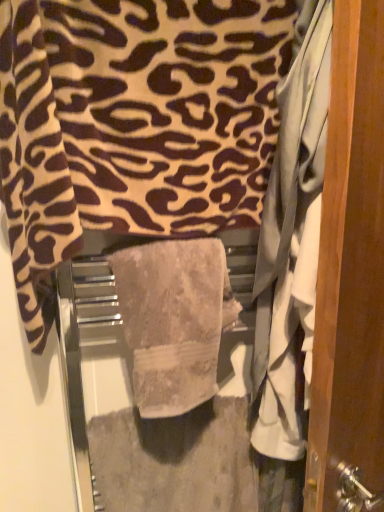
What do you see at coordinates (351, 276) in the screenshot?
I see `wooden door at right` at bounding box center [351, 276].

Find the location of a particular element. The image size is (384, 512). wooden door at right is located at coordinates (351, 276).

Is beige textured towel at center, which appears as the second towel when ordered from the bottom, in contact with beige textured towel at center, which is counted as the first towel, starting from the bottom?

beige textured towel at center, which appears as the second towel when ordered from the bottom, is not next to beige textured towel at center, which is counted as the first towel, starting from the bottom, and they're not touching.

Considering the sizes of objects beige textured towel at center, arranged as the 1th towel when viewed from the top, and beige textured towel at center, which is counted as the first towel, starting from the bottom, in the image provided, who is thinner, beige textured towel at center, arranged as the 1th towel when viewed from the top, or beige textured towel at center, which is counted as the first towel, starting from the bottom,?

beige textured towel at center, which is counted as the first towel, starting from the bottom.

Does beige textured towel at center, arranged as the 1th towel when viewed from the top, have a larger size compared to beige textured towel at center, acting as the 2th towel starting from the top?

Yes, beige textured towel at center, arranged as the 1th towel when viewed from the top, is bigger than beige textured towel at center, acting as the 2th towel starting from the top.

Can you confirm if beige textured towel at center, which appears as the second towel when ordered from the bottom, is shorter than beige textured towel at center, which is counted as the first towel, starting from the bottom?

Incorrect, the height of beige textured towel at center, which appears as the second towel when ordered from the bottom, does not fall short of that of beige textured towel at center, which is counted as the first towel, starting from the bottom.

From the image's perspective, who appears lower, wooden door at right or beige textured towel at center, arranged as the 1th towel when viewed from the top?

wooden door at right, from the image's perspective.

Is point (370, 269) behind point (261, 91)?

No, it is in front of (261, 91).

Between wooden door at right and beige textured towel at center, which appears as the second towel when ordered from the bottom, which one appears on the left side from the viewer's perspective?

Positioned to the left is beige textured towel at center, which appears as the second towel when ordered from the bottom.

In terms of height, does beige textured towel at center, which is counted as the first towel, starting from the bottom, look taller or shorter compared to wooden door at right?

beige textured towel at center, which is counted as the first towel, starting from the bottom, is shorter than wooden door at right.

Where is `towel that is under the wooden door at right (from a real-world perspective)`? towel that is under the wooden door at right (from a real-world perspective) is located at coordinates (174, 320).

From the image's perspective, is beige textured towel at center, which is counted as the first towel, starting from the bottom, above or below wooden door at right?

Clearly, from the image's perspective, beige textured towel at center, which is counted as the first towel, starting from the bottom, is below wooden door at right.

What's the angular difference between beige textured towel at center, which is counted as the first towel, starting from the bottom, and wooden door at right's facing directions?

They differ by 153 degrees in their facing directions.

From the picture: From a real-world perspective, is beige textured towel at center, which appears as the second towel when ordered from the bottom, located higher than wooden door at right?

Yes, from a real-world perspective, beige textured towel at center, which appears as the second towel when ordered from the bottom, is over wooden door at right

Image resolution: width=384 pixels, height=512 pixels. What are the coordinates of `towel that is the 1st one when counting backward from the wooden door at right` in the screenshot? It's located at pyautogui.click(x=132, y=124).

Between beige textured towel at center, arranged as the 1th towel when viewed from the top, and wooden door at right, which one has more height?

With more height is wooden door at right.

Considering the relative sizes of wooden door at right and beige textured towel at center, which is counted as the first towel, starting from the bottom, in the image provided, is wooden door at right wider than beige textured towel at center, which is counted as the first towel, starting from the bottom,?

No, wooden door at right is not wider than beige textured towel at center, which is counted as the first towel, starting from the bottom.

Considering the sizes of objects wooden door at right and beige textured towel at center, acting as the 2th towel starting from the top, in the image provided, who is taller, wooden door at right or beige textured towel at center, acting as the 2th towel starting from the top,?

wooden door at right is taller.

Are wooden door at right and beige textured towel at center, acting as the 2th towel starting from the top, making contact?

No, wooden door at right is not in contact with beige textured towel at center, acting as the 2th towel starting from the top.

Does wooden door at right turn towards beige textured towel at center, acting as the 2th towel starting from the top?

No, wooden door at right is not oriented towards beige textured towel at center, acting as the 2th towel starting from the top.

You are a GUI agent. You are given a task and a screenshot of the screen. Output one action in this format:
    pyautogui.click(x=<x>, y=<y>)
    Task: Click on the towel below the beige textured towel at center, which appears as the second towel when ordered from the bottom (from a real-world perspective)
    
    Given the screenshot: What is the action you would take?
    pyautogui.click(x=174, y=320)

Which is behind, beige textured towel at center, which is counted as the first towel, starting from the bottom, or beige textured towel at center, arranged as the 1th towel when viewed from the top?

beige textured towel at center, which is counted as the first towel, starting from the bottom, is further from the camera.

Measure the distance from beige textured towel at center, which is counted as the first towel, starting from the bottom, to beige textured towel at center, arranged as the 1th towel when viewed from the top.

The distance of beige textured towel at center, which is counted as the first towel, starting from the bottom, from beige textured towel at center, arranged as the 1th towel when viewed from the top, is 7.58 inches.

Locate an element on the screen. Image resolution: width=384 pixels, height=512 pixels. towel above the beige textured towel at center, which is counted as the first towel, starting from the bottom (from a real-world perspective) is located at coordinates (132, 124).

At what (x,y) coordinates should I click in order to perform the action: click on door below the beige textured towel at center, which appears as the second towel when ordered from the bottom (from a real-world perspective). Please return your answer as a coordinate pair (x, y). This screenshot has height=512, width=384. Looking at the image, I should click on (351, 276).

Looking at the image, which one is located further to beige textured towel at center, which appears as the second towel when ordered from the bottom, wooden door at right or beige textured towel at center, acting as the 2th towel starting from the top?

wooden door at right is further to beige textured towel at center, which appears as the second towel when ordered from the bottom.

From the image, which object appears to be nearer to wooden door at right, beige textured towel at center, acting as the 2th towel starting from the top, or beige textured towel at center, arranged as the 1th towel when viewed from the top?

Among the two, beige textured towel at center, acting as the 2th towel starting from the top, is located nearer to wooden door at right.

Based on the photo, which object lies further to the anchor point beige textured towel at center, which appears as the second towel when ordered from the bottom, beige textured towel at center, acting as the 2th towel starting from the top, or wooden door at right?

Based on the image, wooden door at right appears to be further to beige textured towel at center, which appears as the second towel when ordered from the bottom.

Looking at the image, which one is located closer to wooden door at right, beige textured towel at center, arranged as the 1th towel when viewed from the top, or beige textured towel at center, acting as the 2th towel starting from the top?

Among the two, beige textured towel at center, acting as the 2th towel starting from the top, is located nearer to wooden door at right.

Estimate the real-world distances between objects in this image. Which object is closer to beige textured towel at center, which is counted as the first towel, starting from the bottom, beige textured towel at center, which appears as the second towel when ordered from the bottom, or wooden door at right?

Among the two, beige textured towel at center, which appears as the second towel when ordered from the bottom, is located nearer to beige textured towel at center, which is counted as the first towel, starting from the bottom.

From the image, which object appears to be farther from beige textured towel at center, acting as the 2th towel starting from the top, wooden door at right or beige textured towel at center, arranged as the 1th towel when viewed from the top?

wooden door at right.

Find the location of a particular element. towel between beige textured towel at center, arranged as the 1th towel when viewed from the top, and wooden door at right is located at coordinates (174, 320).